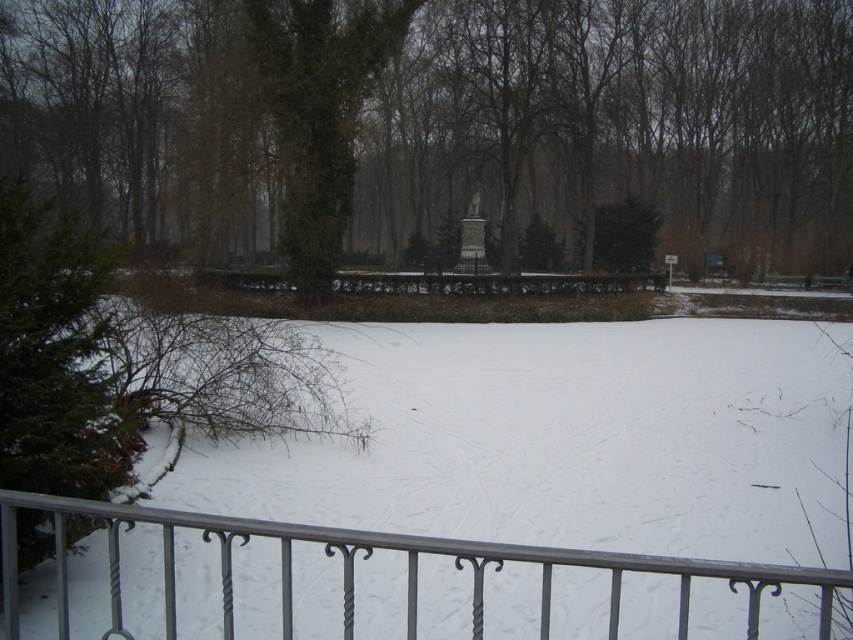
Can you confirm if green leafy tree at center is bigger than metallic silver fence at lower center?

Yes.

Does green leafy tree at center lie behind metallic silver fence at lower center?

That is True.

I want to click on green leafy tree at center, so click(x=439, y=124).

Can you confirm if metallic silver fence at lower center is wider than green ivy-covered tree at center?

Indeed, metallic silver fence at lower center has a greater width compared to green ivy-covered tree at center.

Is metallic silver fence at lower center taller than green ivy-covered tree at center?

Correct, metallic silver fence at lower center is much taller as green ivy-covered tree at center.

Find the location of a particular element. This screenshot has width=853, height=640. metallic silver fence at lower center is located at coordinates (366, 557).

Find the location of a particular element. The image size is (853, 640). metallic silver fence at lower center is located at coordinates (366, 557).

Between green leafy tree at center and green ivy-covered tree at center, which one is positioned higher?

green leafy tree at center is higher up.

I want to click on green leafy tree at center, so click(x=439, y=124).

The width and height of the screenshot is (853, 640). Find the location of `green leafy tree at center`. green leafy tree at center is located at coordinates (439, 124).